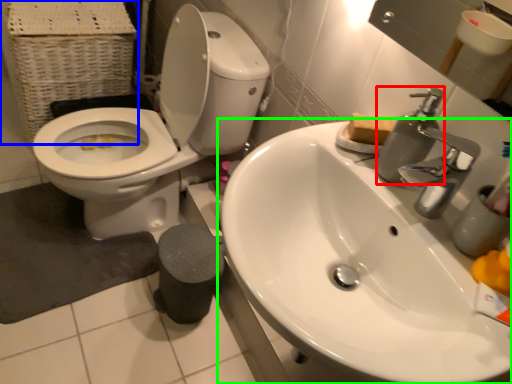
Question: Based on their relative distances, which object is nearer to soap dispenser (highlighted by a red box)? Choose from basket (highlighted by a blue box) and sink (highlighted by a green box).

Choices:
 (A) basket
 (B) sink

Answer: (B)